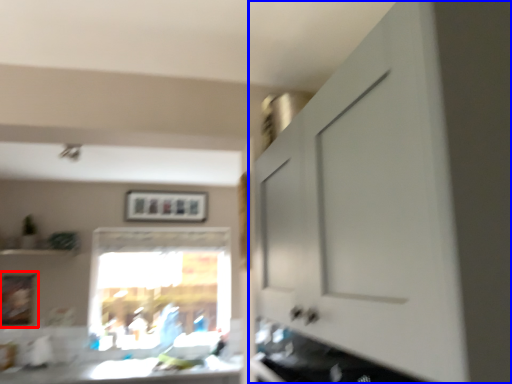
Question: Which object is further to the camera taking this photo, picture frame (highlighted by a red box) or cabinetry (highlighted by a blue box)?

Choices:
 (A) picture frame
 (B) cabinetry

Answer: (A)